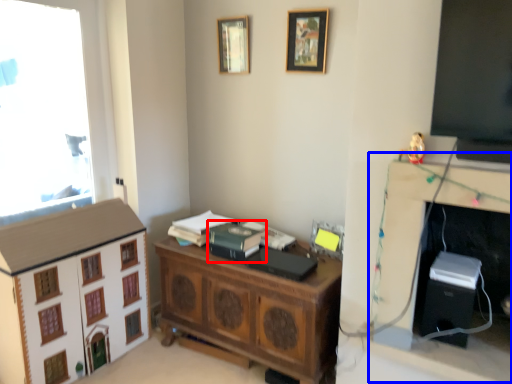
Question: Among these objects, which one is farthest to the camera, book (highlighted by a red box) or computer desk (highlighted by a blue box)?

Choices:
 (A) book
 (B) computer desk

Answer: (A)